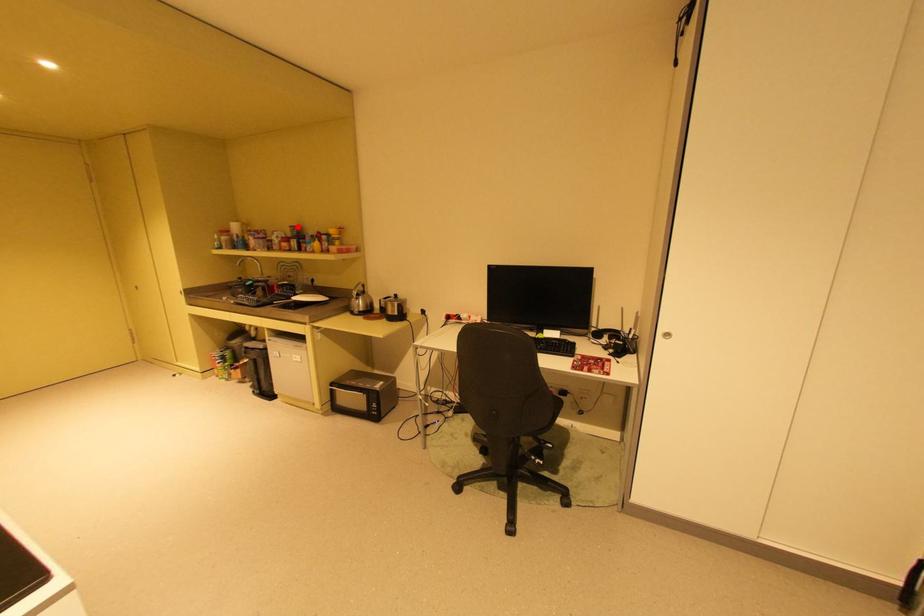
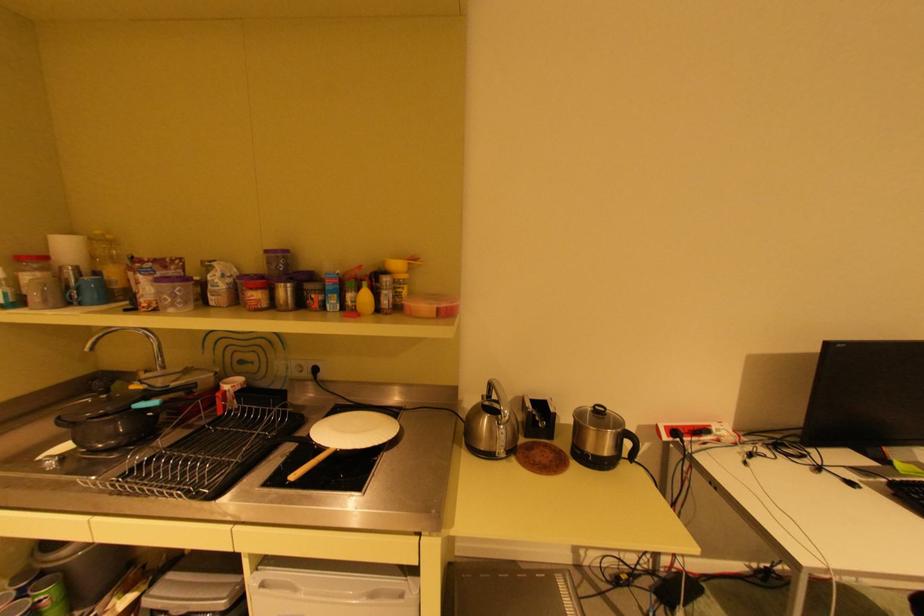
Locate, in the second image, the point that corresponds to the highlighted location in the first image.

(274, 251)